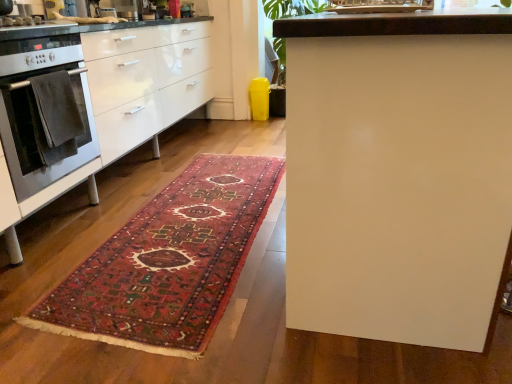
Question: From the image's perspective, is velvety dark gray towel at left over stainless steel oven at left?

Choices:
 (A) yes
 (B) no

Answer: (B)

Question: Is the position of velvety dark gray towel at left more distant than that of stainless steel oven at left?

Choices:
 (A) no
 (B) yes

Answer: (B)

Question: From a real-world perspective, is velvety dark gray towel at left located higher than stainless steel oven at left?

Choices:
 (A) no
 (B) yes

Answer: (A)

Question: Is velvety dark gray towel at left not close to stainless steel oven at left?

Choices:
 (A) no
 (B) yes

Answer: (A)

Question: From the image's perspective, is velvety dark gray towel at left below stainless steel oven at left?

Choices:
 (A) no
 (B) yes

Answer: (B)

Question: Is stainless steel oven at left inside velvety dark gray towel at left?

Choices:
 (A) yes
 (B) no

Answer: (B)

Question: Is velvety dark gray towel at left next to carpeted rug at center and touching it?

Choices:
 (A) no
 (B) yes

Answer: (A)

Question: Can you confirm if velvety dark gray towel at left is taller than carpeted rug at center?

Choices:
 (A) yes
 (B) no

Answer: (A)

Question: Considering the relative sizes of velvety dark gray towel at left and carpeted rug at center in the image provided, is velvety dark gray towel at left wider than carpeted rug at center?

Choices:
 (A) yes
 (B) no

Answer: (B)

Question: From the image's perspective, would you say velvety dark gray towel at left is shown under carpeted rug at center?

Choices:
 (A) yes
 (B) no

Answer: (B)

Question: From a real-world perspective, is velvety dark gray towel at left under carpeted rug at center?

Choices:
 (A) yes
 (B) no

Answer: (B)

Question: Does velvety dark gray towel at left have a lesser height compared to carpeted rug at center?

Choices:
 (A) yes
 (B) no

Answer: (B)

Question: Is there a large distance between carpeted rug at center and stainless steel oven at left?

Choices:
 (A) yes
 (B) no

Answer: (B)